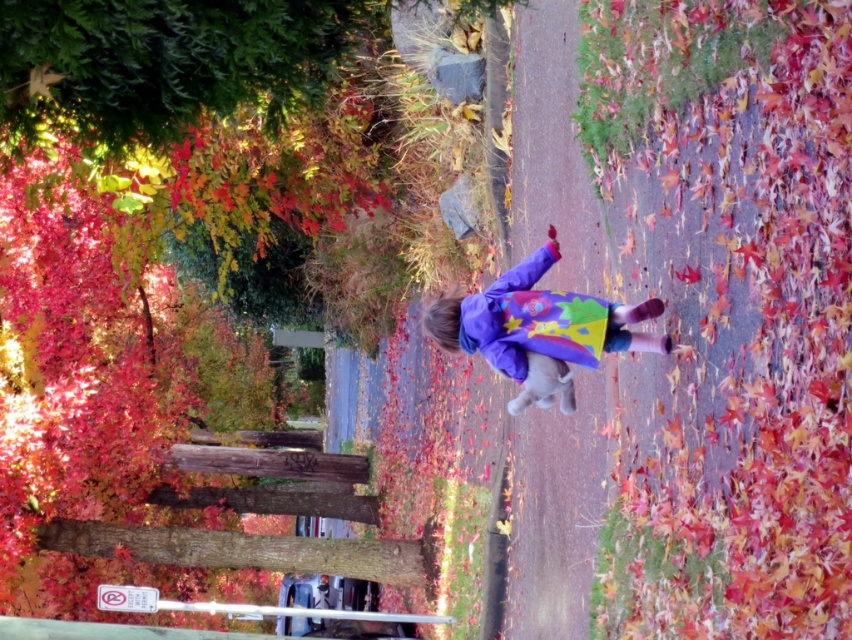
Question: Which point appears farthest from the camera in this image?

Choices:
 (A) (783, 65)
 (B) (188, 19)

Answer: (A)

Question: In this image, where is multicolored fabric at center located relative to purple fleece jacket at center?

Choices:
 (A) right
 (B) left

Answer: (A)

Question: Observing the image, what is the correct spatial positioning of multicolored fabric at center in reference to green leafy tree at upper left?

Choices:
 (A) above
 (B) below

Answer: (B)

Question: Is green leafy tree at upper left above purple fleece jacket at center?

Choices:
 (A) no
 (B) yes

Answer: (B)

Question: Which point is farther to the camera?

Choices:
 (A) purple fleece jacket at center
 (B) green leafy tree at upper left
 (C) multicolored fabric at center

Answer: (A)

Question: Which point is closer to the camera?

Choices:
 (A) multicolored fabric at center
 (B) purple fleece jacket at center
 (C) green leafy tree at upper left

Answer: (C)